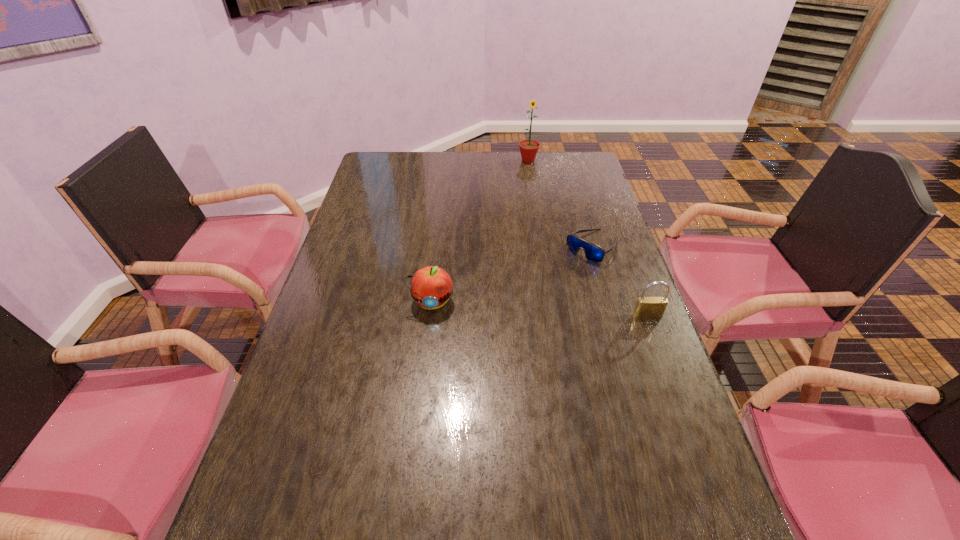
Locate an element on the screen. The image size is (960, 540). the leftmost object is located at coordinates (431, 286).

Identify the location of padlock. The height and width of the screenshot is (540, 960). (646, 307).

Locate an element on the screen. The height and width of the screenshot is (540, 960). sunflower is located at coordinates (528, 148).

Locate an element on the screen. The height and width of the screenshot is (540, 960). the tallest object is located at coordinates (528, 148).

Locate an element on the screen. This screenshot has height=540, width=960. the shortest object is located at coordinates (594, 253).

Find the location of `sunglasses`. sunglasses is located at coordinates (594, 253).

This screenshot has width=960, height=540. In order to click on vacant area situated 0.320m on the surface of the leftmost object in this screenshot , I will do `click(418, 427)`.

The width and height of the screenshot is (960, 540). Find the location of `free space located 0.340m on the front-facing side of the padlock`. free space located 0.340m on the front-facing side of the padlock is located at coordinates (693, 441).

Locate an element on the screen. The width and height of the screenshot is (960, 540). free space located 0.090m on the face of the tallest object is located at coordinates (532, 177).

I want to click on free space located 0.060m on the face of the tallest object, so click(531, 173).